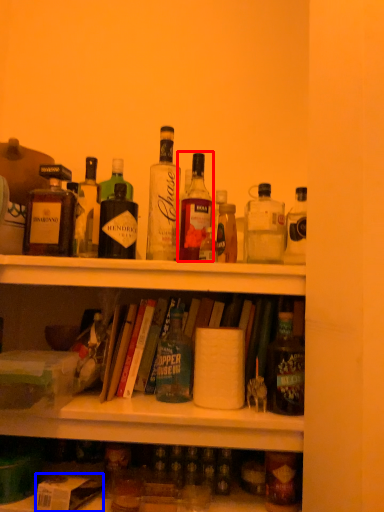
Question: Among these objects, which one is farthest to the camera, bottle (highlighted by a red box) or box (highlighted by a blue box)?

Choices:
 (A) bottle
 (B) box

Answer: (A)